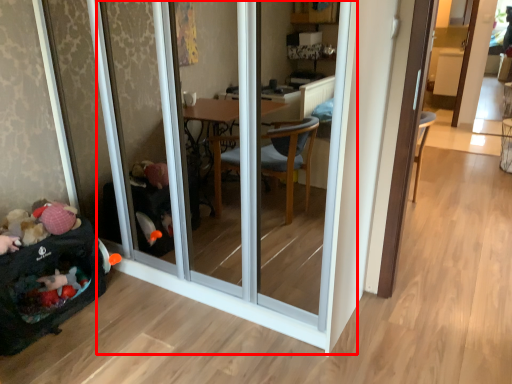
Question: In this image, where is screen door (annotated by the red box) located relative to baby carriage?

Choices:
 (A) left
 (B) right

Answer: (B)